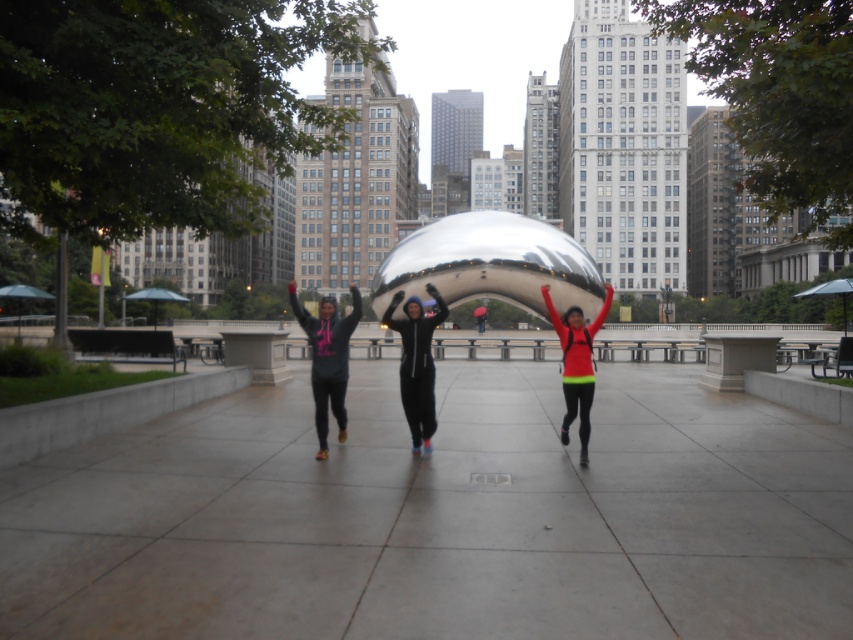
Question: Can you confirm if black matte hoodie at center is smaller than neon green fabric at center?

Choices:
 (A) yes
 (B) no

Answer: (A)

Question: Is the position of neon green fabric at center more distant than that of neon green jacket at center?

Choices:
 (A) no
 (B) yes

Answer: (A)

Question: Can you confirm if black matte hoodie at center is positioned above neon green fabric at center?

Choices:
 (A) no
 (B) yes

Answer: (A)

Question: Based on their relative distances, which object is farther from the neon green jacket at center?

Choices:
 (A) gray concrete pavement at center
 (B) neon green fabric at center
 (C) matte black hoodie at center
 (D) black matte hoodie at center

Answer: (A)

Question: Considering the real-world distances, which object is closest to the gray concrete pavement at center?

Choices:
 (A) black matte hoodie at center
 (B) matte black hoodie at center
 (C) neon green fabric at center

Answer: (C)

Question: Which point is farther to the camera?

Choices:
 (A) matte black hoodie at center
 (B) gray concrete pavement at center
 (C) neon green jacket at center

Answer: (C)